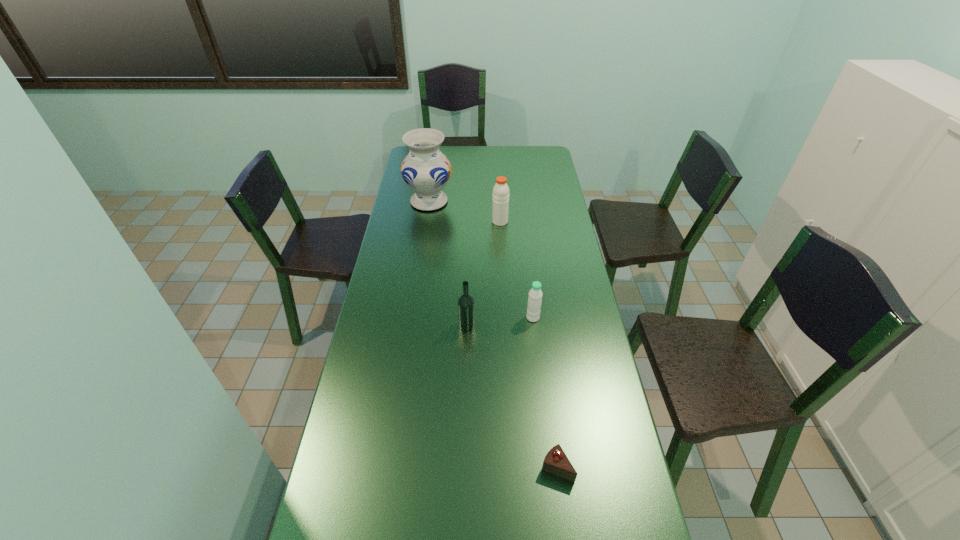
Where is `the tallest object`? the tallest object is located at coordinates (426, 170).

Image resolution: width=960 pixels, height=540 pixels. In order to click on the leftmost object in this screenshot , I will do `click(426, 170)`.

In order to click on the second farthest object in this screenshot , I will do `click(500, 202)`.

The image size is (960, 540). Find the location of `the third object from right to left`. the third object from right to left is located at coordinates coord(500,202).

Where is `the second object from left to right`? The height and width of the screenshot is (540, 960). the second object from left to right is located at coordinates (466, 317).

Image resolution: width=960 pixels, height=540 pixels. I want to click on the second shortest object, so click(x=535, y=294).

Identify the location of the nearest object. (556, 462).

Image resolution: width=960 pixels, height=540 pixels. What are the coordinates of `the shortest object` in the screenshot? It's located at (556, 462).

The image size is (960, 540). I want to click on free space located on the front of the vase, so click(423, 239).

Locate an element on the screen. vacant space located 0.200m on the front of the shaker is located at coordinates (502, 256).